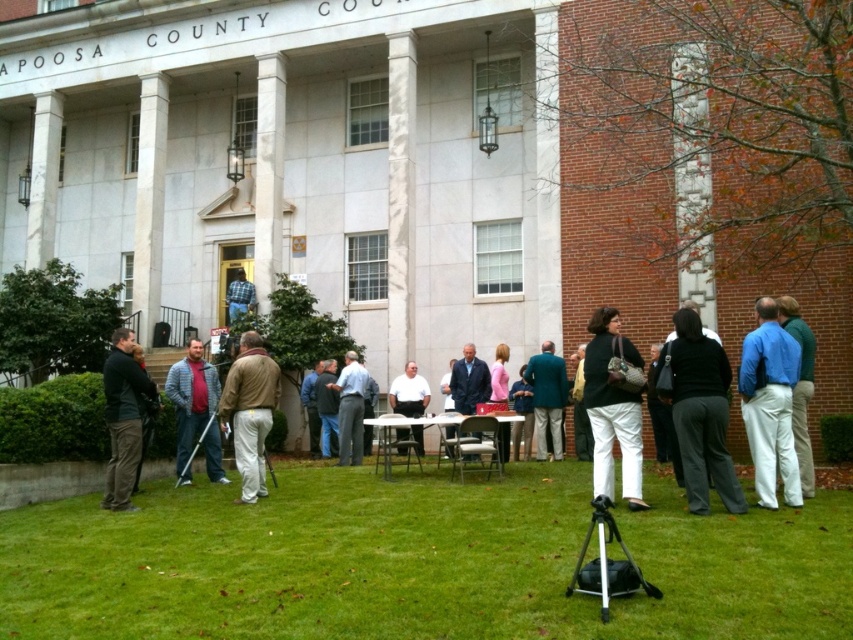
Question: Can you confirm if white shirt at center is positioned above matte black purse at center?

Choices:
 (A) yes
 (B) no

Answer: (B)

Question: Does silver metallic tripod at lower center have a greater width compared to light blue shirt at center?

Choices:
 (A) yes
 (B) no

Answer: (A)

Question: Among these points, which one is farthest from the camera?

Choices:
 (A) (593, 316)
 (B) (746, 369)
 (C) (345, 372)
 (D) (236, 422)

Answer: (C)

Question: Which point is farther to the camera?

Choices:
 (A) blue cotton shirt at center
 (B) silver metallic tripod at lower center

Answer: (A)

Question: Observing the image, what is the correct spatial positioning of white shirt at center in reference to pink fabric jacket at center?

Choices:
 (A) below
 (B) above

Answer: (A)

Question: Which point is closer to the camera taking this photo?

Choices:
 (A) (331, 380)
 (B) (601, 481)
 (C) (254, 412)
 (D) (199, 404)

Answer: (B)